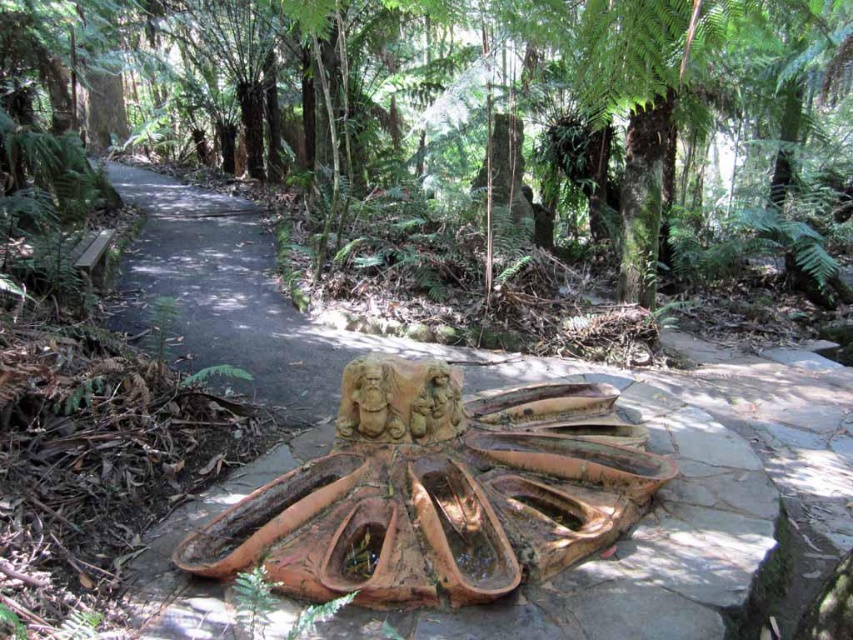
Question: Does green mossy tree at center have a greater width compared to terracotta stone fountain at center?

Choices:
 (A) no
 (B) yes

Answer: (B)

Question: Which object is positioned farthest from the terracotta stone fountain at center?

Choices:
 (A) brown stone statue at center
 (B) brown stone path at center
 (C) green mossy tree at center

Answer: (C)

Question: Which of these objects is positioned closest to the green mossy tree at center?

Choices:
 (A) brown stone path at center
 (B) terracotta stone fountain at center

Answer: (A)

Question: Does green mossy tree at center have a lesser width compared to brown stone path at center?

Choices:
 (A) no
 (B) yes

Answer: (A)

Question: Can you confirm if terracotta stone fountain at center is positioned above brown stone statue at center?

Choices:
 (A) yes
 (B) no

Answer: (B)

Question: Which of the following is the farthest from the observer?

Choices:
 (A) green mossy tree at center
 (B) brown stone statue at center
 (C) brown stone path at center

Answer: (B)